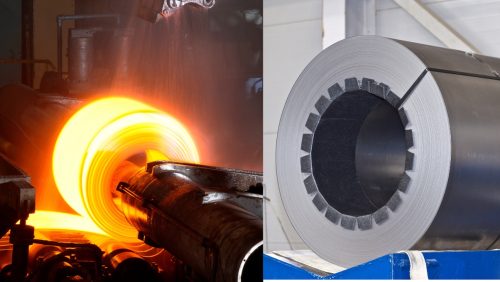
The image size is (500, 282). I want to click on crossbeam, so click(423, 18).